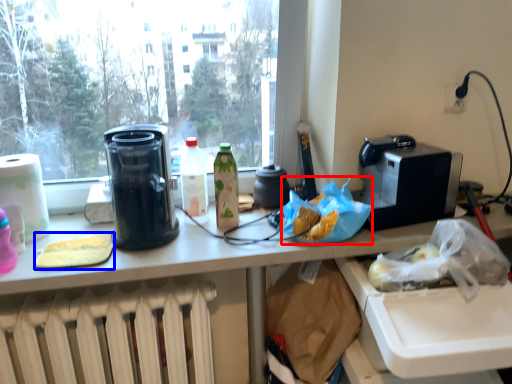
Question: Which object is further to the camera taking this photo, food (highlighted by a red box) or food (highlighted by a blue box)?

Choices:
 (A) food
 (B) food

Answer: (A)